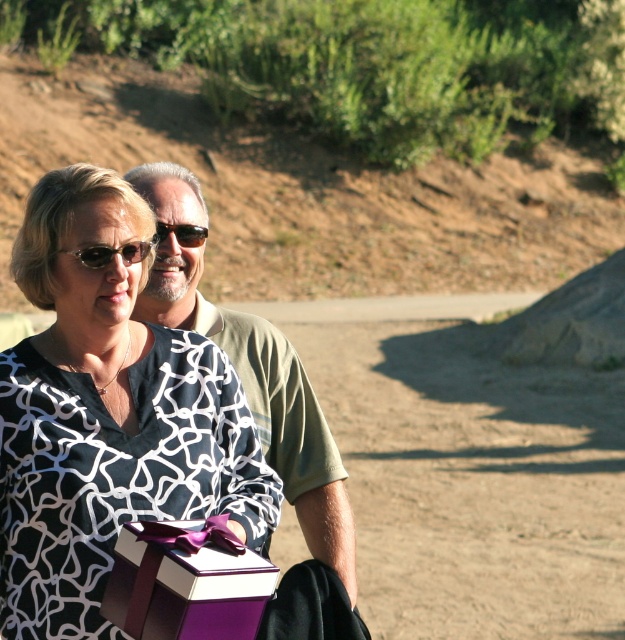
Question: Can you confirm if purple matte gift box at lower center is thinner than black matte sunglasses at upper left?

Choices:
 (A) yes
 (B) no

Answer: (B)

Question: Does purple matte gift box at lower center have a lesser width compared to brown matte sunglasses at center?

Choices:
 (A) no
 (B) yes

Answer: (A)

Question: Which point is closer to the camera taking this photo?

Choices:
 (A) (238, 632)
 (B) (82, 257)
 (C) (68, 406)

Answer: (A)

Question: Does white printed fabric at center appear on the right side of purple matte gift box at lower center?

Choices:
 (A) no
 (B) yes

Answer: (A)

Question: Which point is farther to the camera?

Choices:
 (A) (198, 234)
 (B) (126, 259)
 (C) (188, 170)

Answer: (C)

Question: Which object is closer to the camera taking this photo?

Choices:
 (A) black matte sunglasses at upper left
 (B) green matte shirt at center
 (C) purple matte gift box at lower center
 (D) white printed fabric at center

Answer: (C)